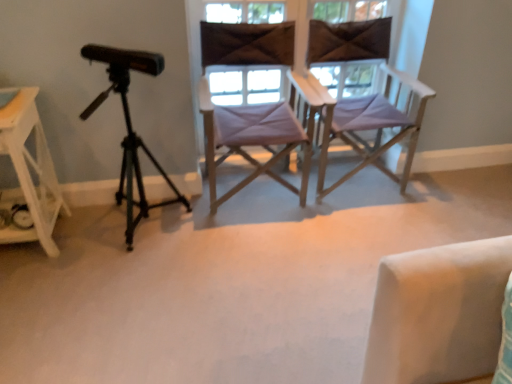
Where is `vacant point above matte purple chair at center, which ranks as the 1th window in right-to-left order (from a real-world perspective)`? The height and width of the screenshot is (384, 512). vacant point above matte purple chair at center, which ranks as the 1th window in right-to-left order (from a real-world perspective) is located at coordinates (270, 0).